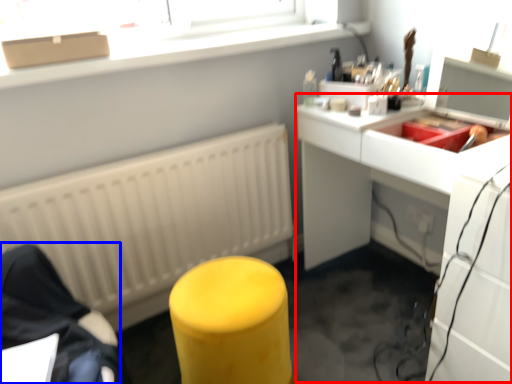
Question: Which object appears farthest to the camera in this image, computer desk (highlighted by a red box) or furniture (highlighted by a blue box)?

Choices:
 (A) computer desk
 (B) furniture

Answer: (B)